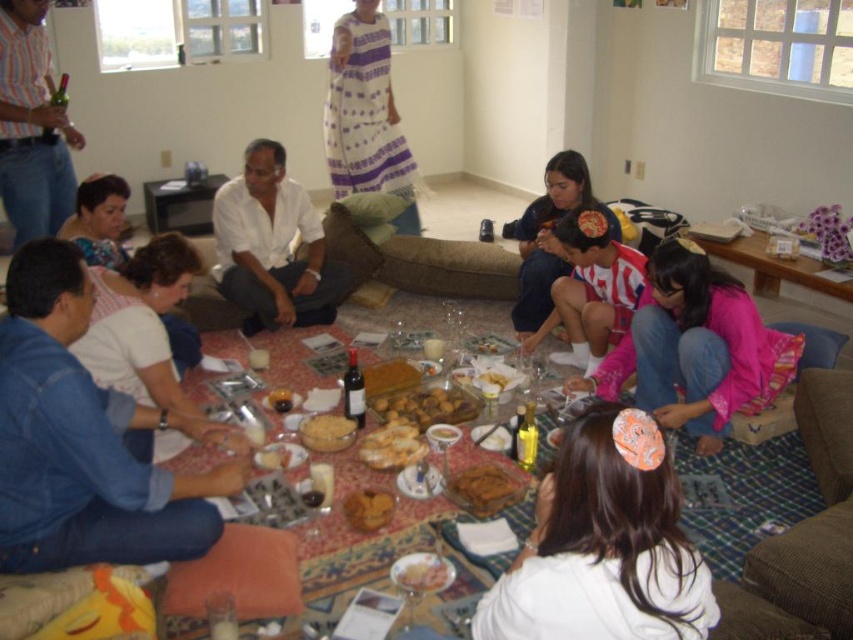
Between point (10, 92) and point (337, 436), which one is positioned in front?

Positioned in front is point (337, 436).

Does point (55, 184) come closer to viewer compared to point (349, 440)?

That is False.

The image size is (853, 640). Identify the location of striped cotton shirt at upper left. (32, 128).

Is striped cotton shirt at upper left wider than smooth brown bread at center?

Correct, the width of striped cotton shirt at upper left exceeds that of smooth brown bread at center.

The width and height of the screenshot is (853, 640). What do you see at coordinates (32, 128) in the screenshot? I see `striped cotton shirt at upper left` at bounding box center [32, 128].

Is point (62, 124) in front of point (440, 440)?

No, it is behind (440, 440).

Where is `striped cotton shirt at upper left`? This screenshot has width=853, height=640. striped cotton shirt at upper left is located at coordinates (32, 128).

Consider the image. Who is positioned more to the right, white fabric hair clip at lower center or striped cotton shirt at upper left?

From the viewer's perspective, white fabric hair clip at lower center appears more on the right side.

Is point (592, 508) behind point (9, 141)?

No, (592, 508) is closer to viewer.

Is point (622, 408) more distant than point (22, 184)?

That is False.

Where is `white fabric hair clip at lower center`? The width and height of the screenshot is (853, 640). white fabric hair clip at lower center is located at coordinates (604, 545).